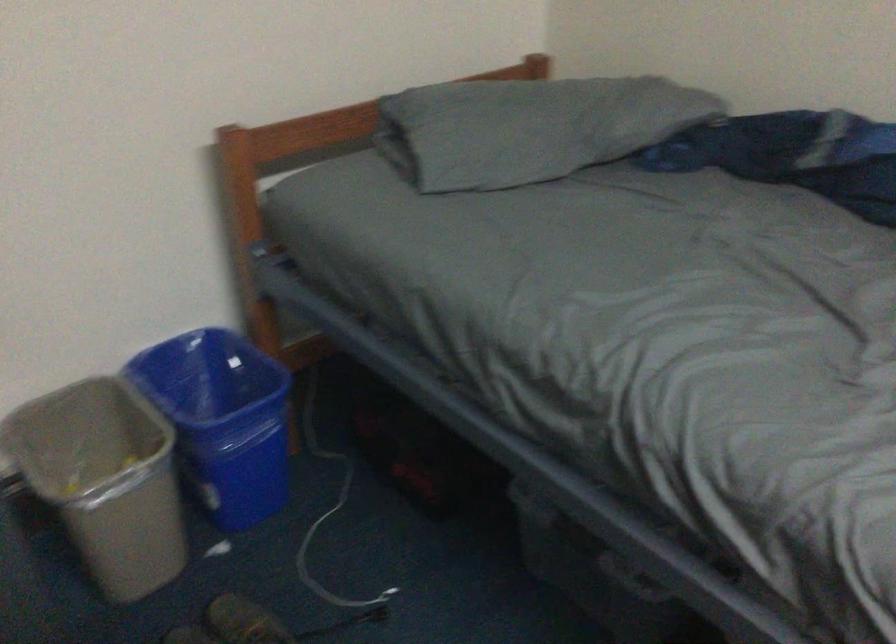
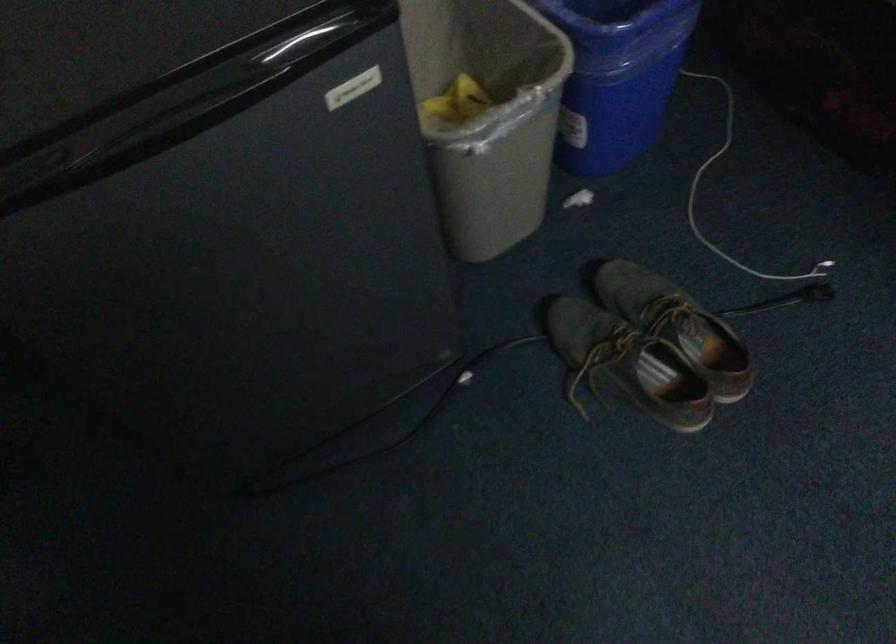
In the second image, find the point that corresponds to the point at 100,480 in the first image.

(487, 115)